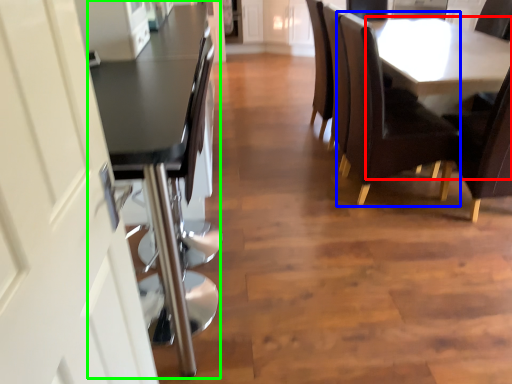
Question: Which object is positioned farthest from table (highlighted by a red box)? Select from chair (highlighted by a blue box) and table (highlighted by a green box).

Choices:
 (A) chair
 (B) table

Answer: (B)